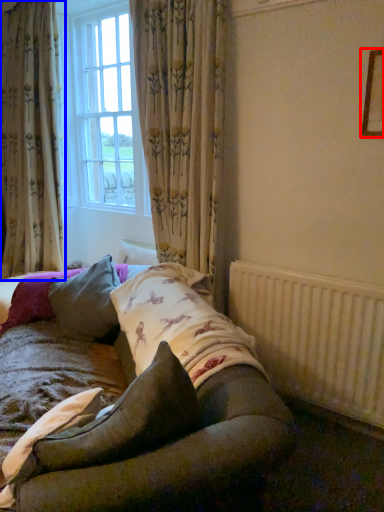
Question: Which point is further to the camera, picture frame (highlighted by a red box) or curtain (highlighted by a blue box)?

Choices:
 (A) picture frame
 (B) curtain

Answer: (B)